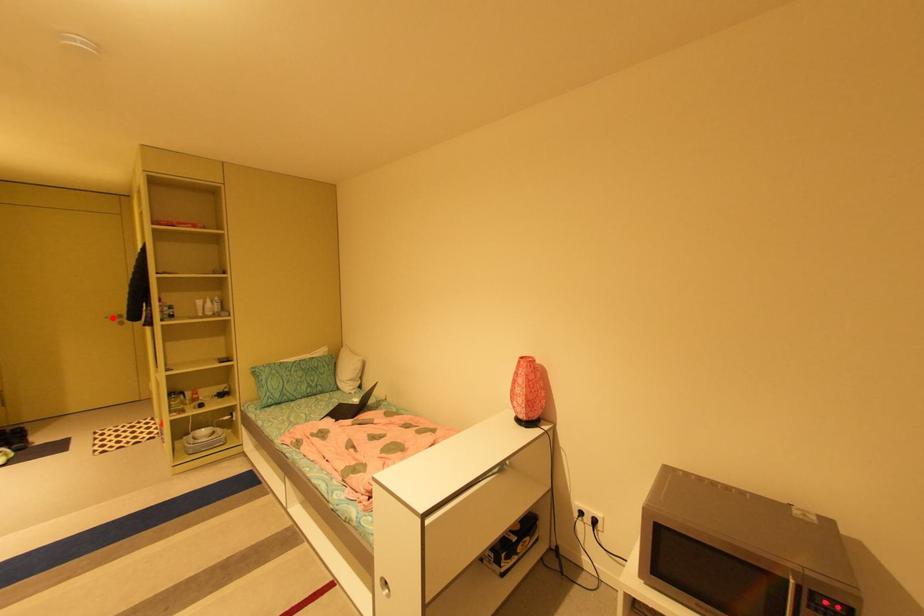
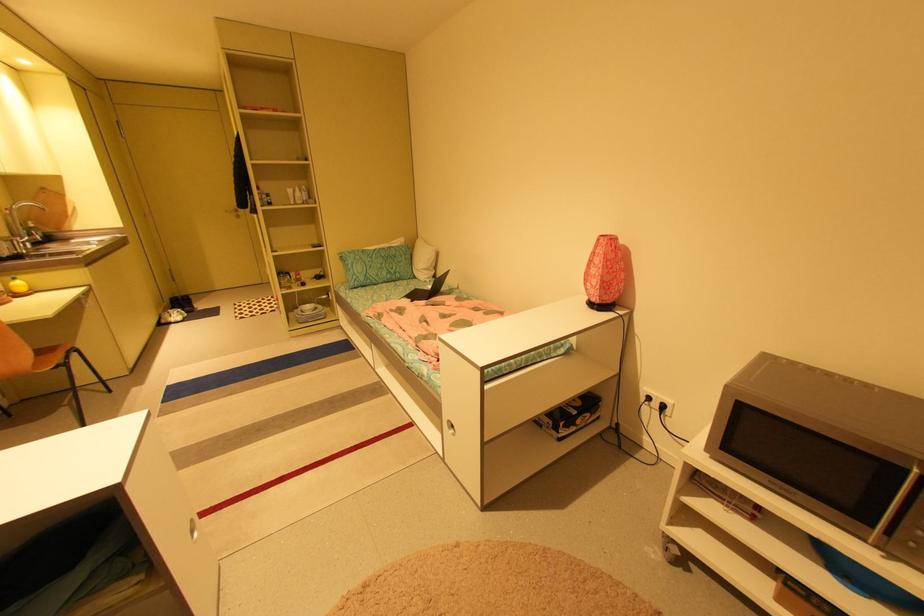
The point at the highlighted location is marked in the first image. Where is the corresponding point in the second image?

(232, 211)